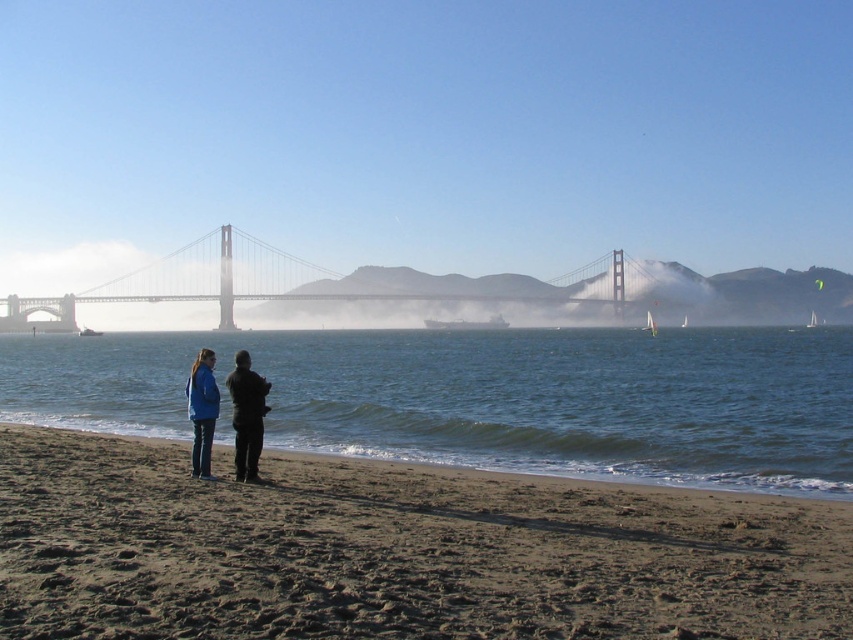
Question: Which point is closer to the camera?

Choices:
 (A) blue fabric jacket at lower left
 (B) black matte jacket at center
 (C) brown sand at lower center
 (D) blue fabric jacket at center

Answer: (C)

Question: Is brown sand at lower center smaller than blue fabric jacket at center?

Choices:
 (A) no
 (B) yes

Answer: (A)

Question: Which of the following is the farthest from the observer?

Choices:
 (A) (483, 435)
 (B) (193, 449)
 (C) (206, 417)

Answer: (A)

Question: Does brown sand at lower center have a lesser width compared to black matte jacket at center?

Choices:
 (A) yes
 (B) no

Answer: (B)

Question: Is brown sand at lower center thinner than blue fabric jacket at center?

Choices:
 (A) yes
 (B) no

Answer: (B)

Question: Which object is positioned closest to the brown sand at lower center?

Choices:
 (A) blue fabric jacket at center
 (B) blue water at lower center
 (C) black matte jacket at center
 (D) blue fabric jacket at lower left

Answer: (C)